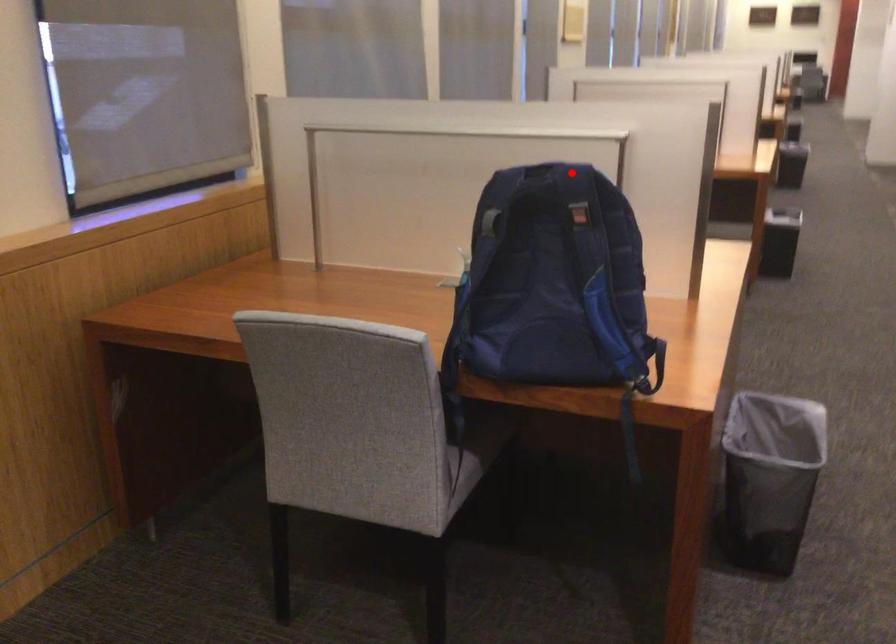
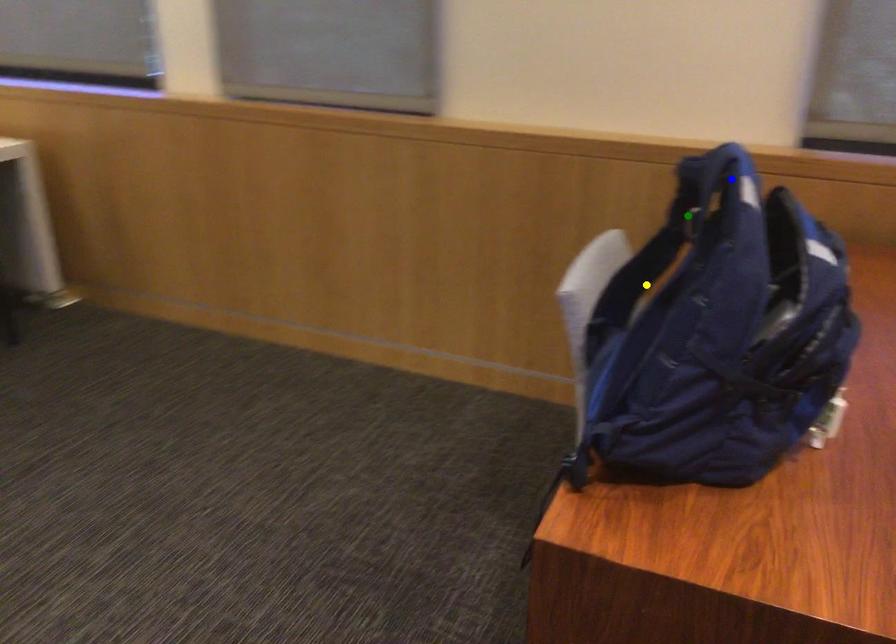
Question: I am providing you with two images of the same scene from different viewpoints. A red point is marked on the first image. You are given multiple points on the second image. Can you choose the point in image 2 that corresponds to the point in image 1?

Choices:
 (A) green point
 (B) yellow point
 (C) blue point

Answer: (C)